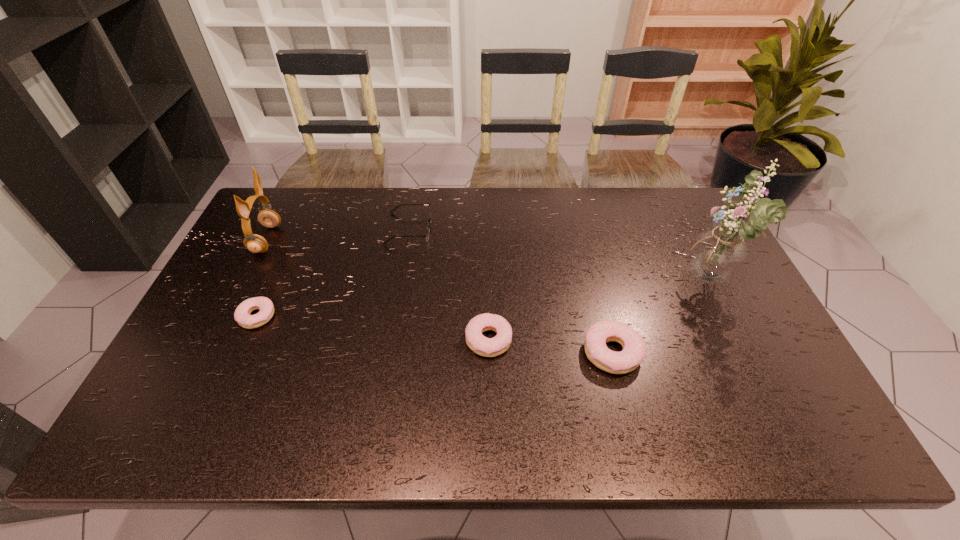
You are a GUI agent. You are given a task and a screenshot of the screen. Output one action in this format:
    pyautogui.click(x=<x>, y=<y>)
    Task: Click on the free space located 0.230m on the right of the shortest object
    The height and width of the screenshot is (540, 960).
    Given the screenshot: What is the action you would take?
    pyautogui.click(x=359, y=316)

Locate an element on the screen. Image resolution: width=960 pixels, height=540 pixels. vacant space located 0.340m on the left of the second shortest doughnut is located at coordinates (335, 340).

Identify the location of vacant space located 0.380m on the left of the fifth object from left to right. Image resolution: width=960 pixels, height=540 pixels. (434, 353).

Identify the location of vacant area situated 0.220m on the front-facing side of the spectacles. point(498,228).

Image resolution: width=960 pixels, height=540 pixels. Identify the location of vacant space located on the front-facing side of the tallest object. (579, 282).

You are a GUI agent. You are given a task and a screenshot of the screen. Output one action in this format:
    pyautogui.click(x=<x>, y=<y>)
    Task: Click on the free space located 0.250m on the front-facing side of the tallest object
    This screenshot has width=960, height=540.
    Given the screenshot: What is the action you would take?
    pyautogui.click(x=596, y=282)

Locate an element on the screen. The image size is (960, 540). free space located 0.230m on the front-facing side of the tallest object is located at coordinates (603, 282).

You are a GUI agent. You are given a task and a screenshot of the screen. Output one action in this format:
    pyautogui.click(x=<x>, y=<y>)
    Task: Click on the vacant region located on the front-facing side of the fifth shortest object
    
    Given the screenshot: What is the action you would take?
    pyautogui.click(x=402, y=239)

At what (x,y) coordinates should I click in order to perform the action: click on spectacles that is at the far edge. Please return your answer as a coordinate pair (x, y). Looking at the image, I should click on (428, 227).

In order to click on earphone that is positioned at the far edge in this screenshot , I will do `click(254, 243)`.